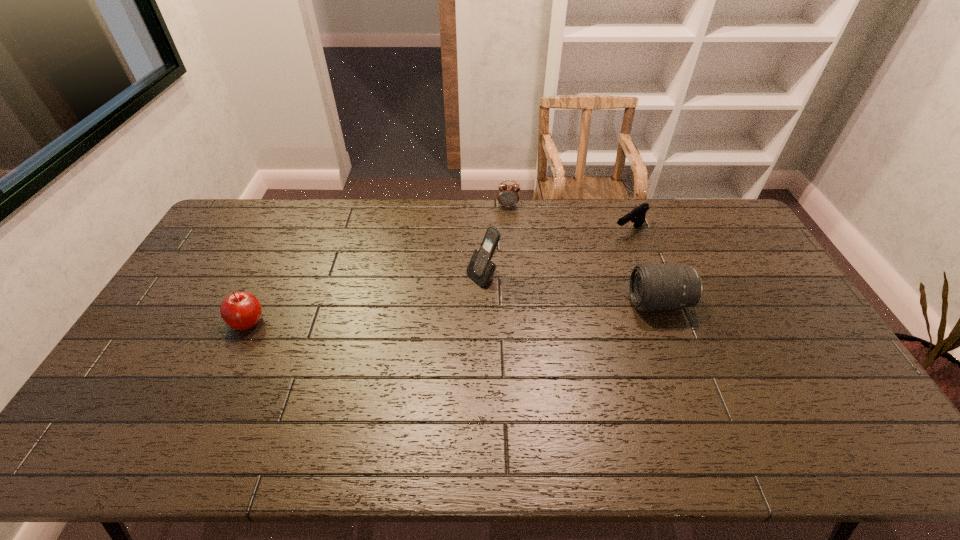
The height and width of the screenshot is (540, 960). In order to click on free region located on the front-facing side of the pistol in this screenshot , I will do `click(541, 287)`.

This screenshot has height=540, width=960. I want to click on alarm clock present at the far edge, so click(508, 195).

Where is `pistol that is at the far edge`? The width and height of the screenshot is (960, 540). pistol that is at the far edge is located at coordinates (637, 215).

Find the location of a particular element. Image resolution: width=960 pixels, height=540 pixels. vacant area at the far edge of the desktop is located at coordinates (305, 231).

Where is `vacant space at the near edge of the desktop`? The width and height of the screenshot is (960, 540). vacant space at the near edge of the desktop is located at coordinates (705, 386).

Where is `free location at the left edge`? free location at the left edge is located at coordinates (164, 320).

The width and height of the screenshot is (960, 540). I want to click on vacant space at the right edge, so click(x=757, y=269).

What are the coordinates of `free space between the alarm clock and the shortest object` in the screenshot? It's located at (568, 219).

Identify the location of vacant region between the pistol and the third object from left to right. (568, 219).

This screenshot has width=960, height=540. Find the location of `empty space that is in between the second farthest object and the cellular telephone`. empty space that is in between the second farthest object and the cellular telephone is located at coordinates (556, 254).